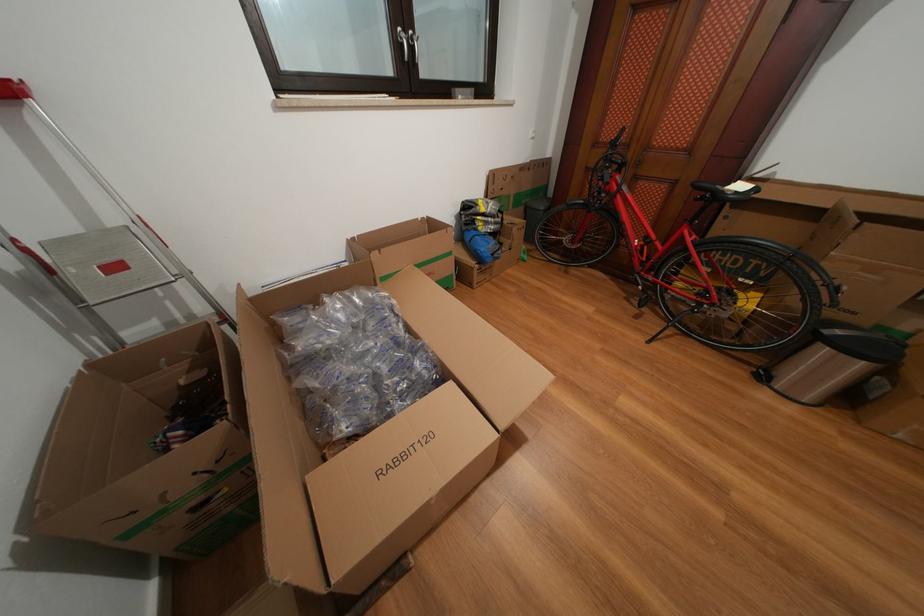
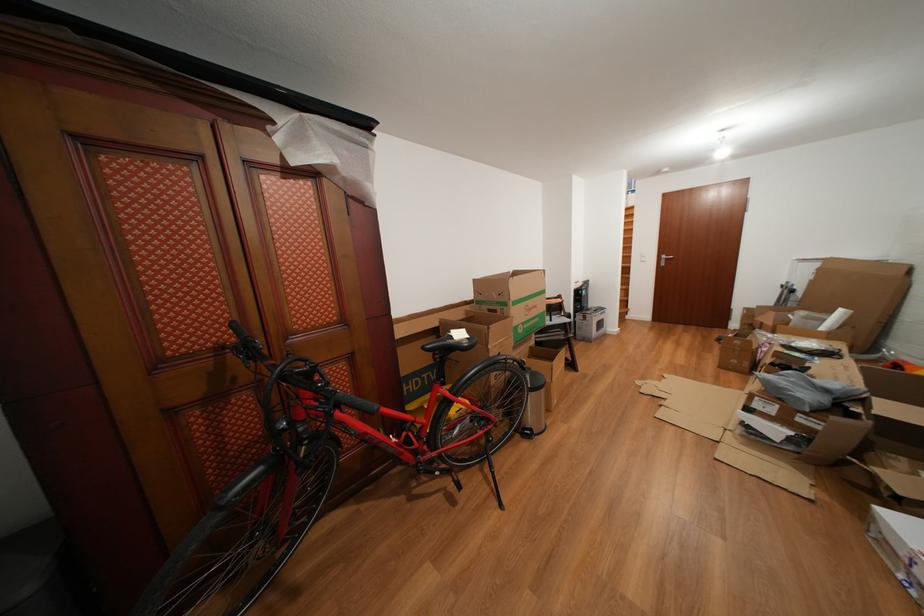
Where in the second image is the point corresponding to point (837, 211) from the first image?

(445, 330)